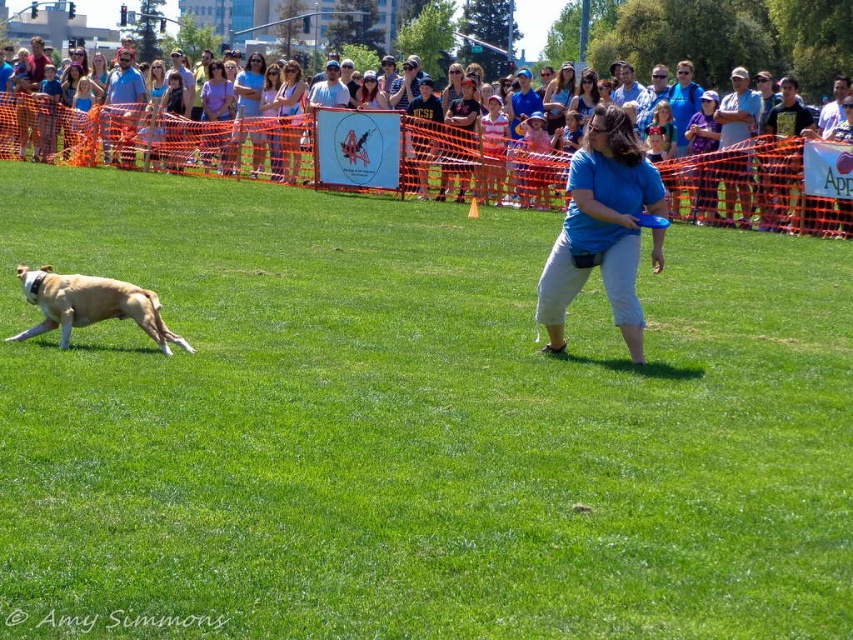
You are a photographer trying to capture the perfect shot of the frisbee and the dog. You notice two points in the scene labeled as point (286, 115) and point (264, 83). If you want to focus on the closer point to ensure sharpness, which coordinate should you choose?

Point (286, 115) is closer to the camera than point (264, 83), so you should choose point (286, 115) to ensure sharpness.

Consider the image. You are a photographer trying to capture the most detailed shot of the light brown hair at upper center and the matte blue shirt at center. Based on their size in the image, which one would you focus on first to ensure clarity?

Since the light brown hair at upper center occupies less space than the matte blue shirt at center, it would be better to focus on the light brown hair at upper center first to ensure its clarity, as smaller objects often require more precise focusing to capture details.